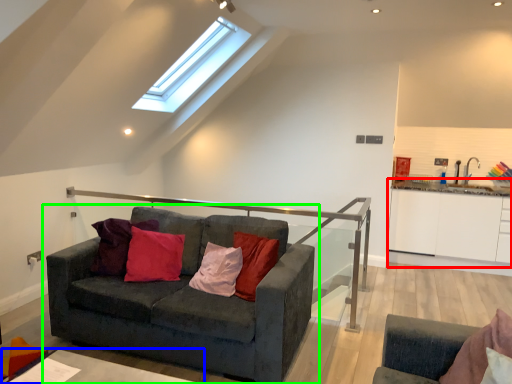
Question: Which object is the closest to the cabinetry (highlighted by a red box)? Choose among these: table (highlighted by a blue box) or studio couch (highlighted by a green box).

Choices:
 (A) table
 (B) studio couch

Answer: (B)